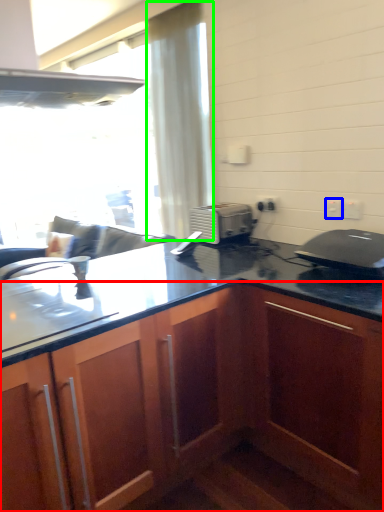
Question: Which is farther away from cabinetry (highlighted by a red box)? electric outlet (highlighted by a blue box) or curtain (highlighted by a green box)?

Choices:
 (A) electric outlet
 (B) curtain

Answer: (B)